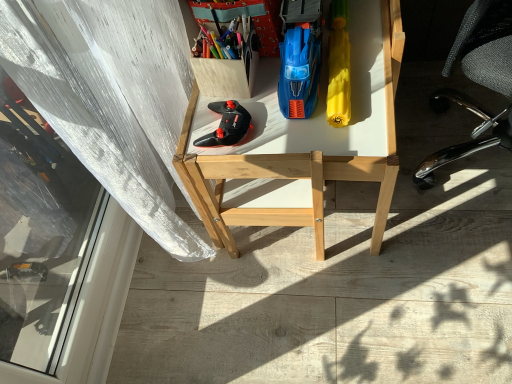
You are a GUI agent. You are given a task and a screenshot of the screen. Output one action in this format:
    pyautogui.click(x=<x>, y=<y>)
    Task: Click on the free point below black mesh office chair at right (from a real-world perspective)
    
    Given the screenshot: What is the action you would take?
    pyautogui.click(x=467, y=160)